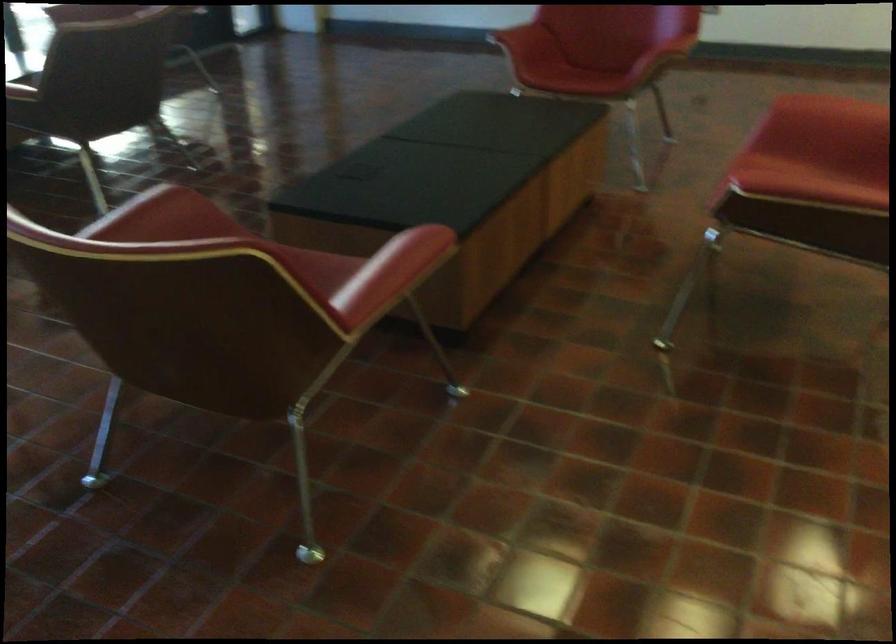
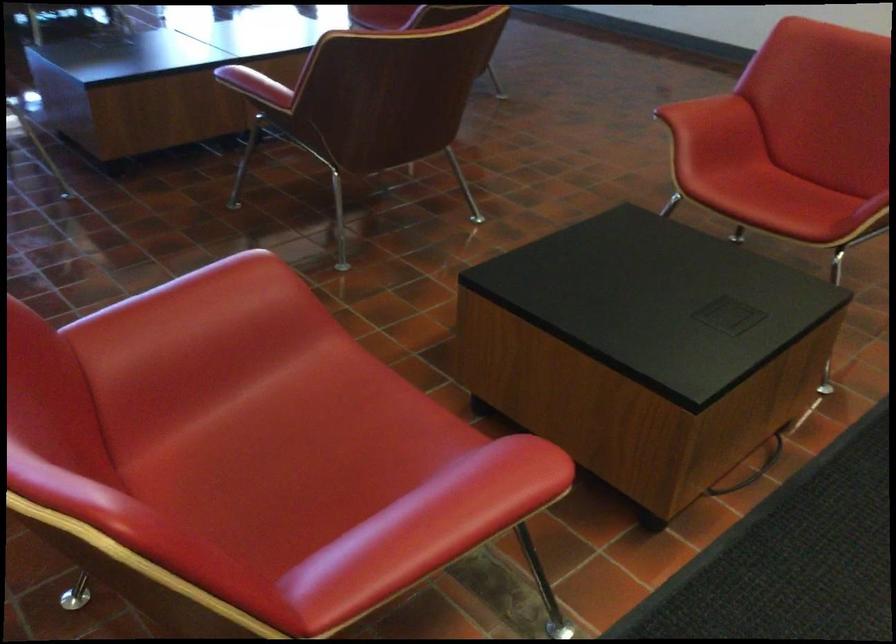
Question: The images are taken continuously from a first-person perspective. In which direction are you moving?

Choices:
 (A) Left
 (B) Right
 (C) Forward
 (D) Backward

Answer: (B)